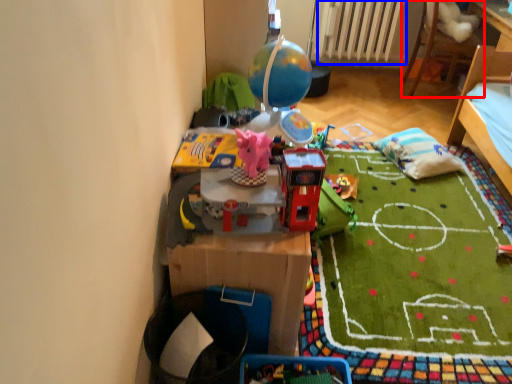
Question: Among these objects, which one is farthest to the camera, furniture (highlighted by a red box) or radiator (highlighted by a blue box)?

Choices:
 (A) furniture
 (B) radiator

Answer: (B)